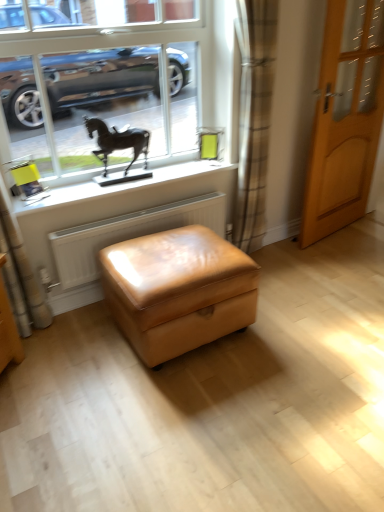
The height and width of the screenshot is (512, 384). What do you see at coordinates (345, 118) in the screenshot?
I see `light brown wooden door at right` at bounding box center [345, 118].

Image resolution: width=384 pixels, height=512 pixels. What do you see at coordinates (254, 117) in the screenshot? I see `plaid fabric curtain at center` at bounding box center [254, 117].

Find the location of a particular element. metallic horse statue at upper left is located at coordinates (116, 82).

Describe the element at coordinates (178, 290) in the screenshot. Image resolution: width=384 pixels, height=512 pixels. I see `leather ottoman at center` at that location.

The width and height of the screenshot is (384, 512). What are the coordinates of `light brown wooden door at right` in the screenshot? It's located at (345, 118).

Considering the relative positions of white matte window sill at upper center and black metal horse at upper center in the image provided, is white matte window sill at upper center to the left of black metal horse at upper center from the viewer's perspective?

In fact, white matte window sill at upper center is to the right of black metal horse at upper center.

From the image's perspective, which object appears higher, white matte window sill at upper center or black metal horse at upper center?

black metal horse at upper center is shown above in the image.

Consider the image. Considering the sizes of white textured radiator at lower center and white matte window sill at upper center in the image, is white textured radiator at lower center wider or thinner than white matte window sill at upper center?

In the image, white textured radiator at lower center appears to be more narrow than white matte window sill at upper center.

From the image's perspective, would you say white textured radiator at lower center is positioned over white matte window sill at upper center?

No.

Is white textured radiator at lower center looking in the opposite direction of white matte window sill at upper center?

No, white matte window sill at upper center is not at the back of white textured radiator at lower center.

From a real-world perspective, is white textured radiator at lower center on top of white matte window sill at upper center?

Actually, white textured radiator at lower center is physically below white matte window sill at upper center in the real world.

Measure the distance between black metal horse at upper center and plaid fabric curtain at center.

black metal horse at upper center is 27.20 inches from plaid fabric curtain at center.

Is point (148, 142) farther from viewer compared to point (241, 137)?

Yes, it is behind point (241, 137).

Is black metal horse at upper center facing towards plaid fabric curtain at center?

No, black metal horse at upper center is not aimed at plaid fabric curtain at center.

Between black metal horse at upper center and plaid fabric curtain at center, which one has smaller width?

With smaller width is black metal horse at upper center.

How much distance is there between black metal horse at upper center and light brown wooden door at right?

black metal horse at upper center is 4.15 feet away from light brown wooden door at right.

In the scene shown: Which is correct: black metal horse at upper center is inside light brown wooden door at right, or outside of it?

black metal horse at upper center is outside light brown wooden door at right.

From their relative heights in the image, would you say black metal horse at upper center is taller or shorter than light brown wooden door at right?

Considering their sizes, black metal horse at upper center has less height than light brown wooden door at right.

Which is farther, (145, 123) or (207, 203)?

Positioned behind is point (207, 203).

Is metallic horse statue at upper left taller than white textured radiator at lower center?

Indeed, metallic horse statue at upper left has a greater height compared to white textured radiator at lower center.

Is metallic horse statue at upper left aimed at white textured radiator at lower center?

No, metallic horse statue at upper left is not turned towards white textured radiator at lower center.

Is metallic horse statue at upper left not near white textured radiator at lower center?

No, there isn't a large distance between metallic horse statue at upper left and white textured radiator at lower center.

From a real-world perspective, is white textured radiator at lower center positioned above or below black metal horse at upper center?

From a real-world perspective, white textured radiator at lower center is physically below black metal horse at upper center.

Are white textured radiator at lower center and black metal horse at upper center far apart?

They are positioned close to each other.

Visually, is white textured radiator at lower center positioned to the left or to the right of black metal horse at upper center?

In the image, white textured radiator at lower center appears on the right side of black metal horse at upper center.

Is white textured radiator at lower center not inside black metal horse at upper center?

Yes, white textured radiator at lower center is not within black metal horse at upper center.

From the image's perspective, which is below, metallic horse statue at upper left or white matte window sill at upper center?

white matte window sill at upper center appears lower in the image.

Is metallic horse statue at upper left at the left side of white matte window sill at upper center?

Yes, metallic horse statue at upper left is to the left of white matte window sill at upper center.

Locate an element on the screen. window sill lying behind the metallic horse statue at upper left is located at coordinates (136, 193).

Who is taller, metallic horse statue at upper left or white matte window sill at upper center?

With more height is metallic horse statue at upper left.

What are the coordinates of `window sill in front of the black metal horse at upper center` in the screenshot? It's located at (136, 193).

What are the coordinates of `radiator that is below the white matte window sill at upper center (from the image's perspective)` in the screenshot? It's located at (128, 234).

Which object lies further to the anchor point metallic horse statue at upper left, plaid fabric curtain at center or black metal horse at upper center?

plaid fabric curtain at center lies further to metallic horse statue at upper left than the other object.

From the image, which object appears to be farther from plaid fabric curtain at center, light brown wooden door at right or metallic horse statue at upper left?

metallic horse statue at upper left is further to plaid fabric curtain at center.

Based on their spatial positions, is black metal horse at upper center or plaid fabric curtain at center closer to leather ottoman at center?

Among the two, black metal horse at upper center is located nearer to leather ottoman at center.

When comparing their distances from white textured radiator at lower center, does plaid fabric curtain at center or leather ottoman at center seem further?

plaid fabric curtain at center is further to white textured radiator at lower center.

When comparing their distances from white textured radiator at lower center, does plaid fabric curtain at center or black metal horse at upper center seem closer?

Among the two, black metal horse at upper center is located nearer to white textured radiator at lower center.

Which object lies further to the anchor point black metal horse at upper center, white matte window sill at upper center or white textured radiator at lower center?

Based on the image, white textured radiator at lower center appears to be further to black metal horse at upper center.

From the image, which object appears to be farther from white matte window sill at upper center, leather ottoman at center or white textured radiator at lower center?

leather ottoman at center lies further to white matte window sill at upper center than the other object.

In the scene shown: When comparing their distances from light brown wooden door at right, does plaid fabric curtain at center or black metal horse at upper center seem closer?

Among the two, plaid fabric curtain at center is located nearer to light brown wooden door at right.

The height and width of the screenshot is (512, 384). In order to click on radiator between metallic horse statue at upper left and leather ottoman at center vertically in this screenshot , I will do `click(128, 234)`.

At what (x,y) coordinates should I click in order to perform the action: click on stool situated between white textured radiator at lower center and light brown wooden door at right from left to right. Please return your answer as a coordinate pair (x, y). Looking at the image, I should click on click(178, 290).

Identify the location of window sill between black metal horse at upper center and plaid fabric curtain at center from left to right. This screenshot has width=384, height=512. (136, 193).

Locate an element on the screen. window sill that lies between plaid fabric curtain at center and leather ottoman at center from top to bottom is located at coordinates (136, 193).